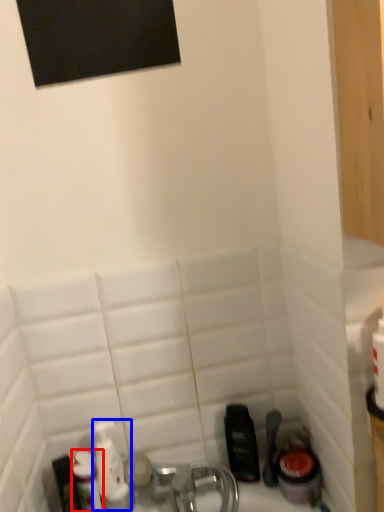
Question: Which of the following is the farthest to the observer, toiletry (highlighted by a red box) or mouthwash (highlighted by a blue box)?

Choices:
 (A) toiletry
 (B) mouthwash

Answer: (B)